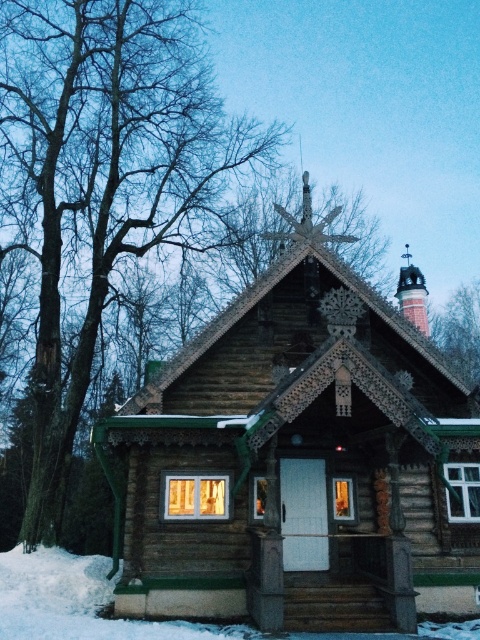
Question: Which of the following is the closest to the observer?

Choices:
 (A) wooden cabin at center
 (B) white fluffy snow at bottom
 (C) brown wood tree at upper left

Answer: (B)

Question: Is wooden cabin at center positioned before white fluffy snow at bottom?

Choices:
 (A) no
 (B) yes

Answer: (A)

Question: Estimate the real-world distances between objects in this image. Which object is farther from the brown wood tree at upper left?

Choices:
 (A) white fluffy snow at bottom
 (B) wooden cabin at center

Answer: (B)

Question: Does brown wood tree at upper left appear under white fluffy snow at bottom?

Choices:
 (A) no
 (B) yes

Answer: (A)

Question: Which is nearer to the white fluffy snow at bottom?

Choices:
 (A) brown wood tree at upper left
 (B) wooden cabin at center

Answer: (B)

Question: Is brown wood tree at upper left further to camera compared to white fluffy snow at bottom?

Choices:
 (A) no
 (B) yes

Answer: (B)